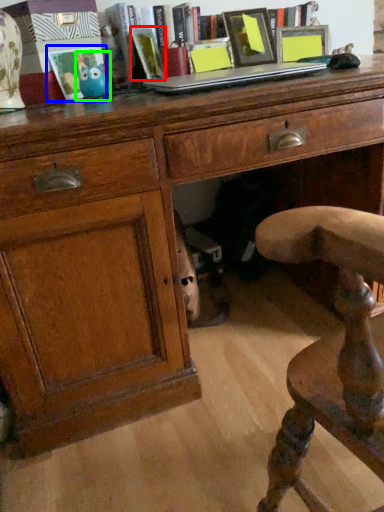
Question: Which is farther away from book (highlighted by a red box)? picture frame (highlighted by a blue box) or toy (highlighted by a green box)?

Choices:
 (A) picture frame
 (B) toy

Answer: (A)